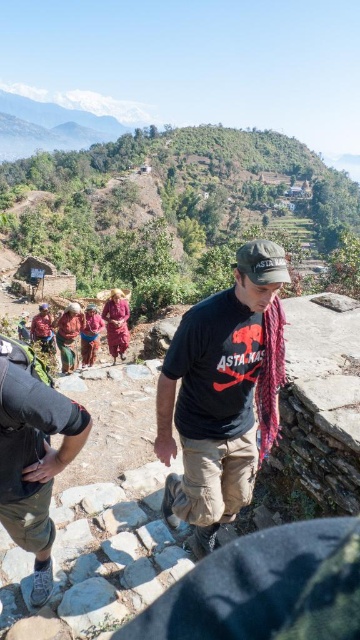
Question: Which object is closer to the camera taking this photo?

Choices:
 (A) purple fabric at center
 (B) reddish brown fabric at lower left
 (C) black cotton t-shirt at center
 (D) matte red scarf at lower left

Answer: (C)

Question: Which point appears farthest from the camera in this image?

Choices:
 (A) (46, 323)
 (B) (73, 352)

Answer: (A)

Question: Which object is positioned closest to the matte red scarf at lower left?

Choices:
 (A) green grassy hillside at upper center
 (B) black cotton t-shirt at center
 (C) matte khaki shorts at lower left
 (D) purple fabric at center

Answer: (D)

Question: Can you confirm if matte khaki shorts at lower left is thinner than purple fabric at center?

Choices:
 (A) yes
 (B) no

Answer: (A)

Question: Is purple fabric at center positioned at the back of orange fabric skirt at center?

Choices:
 (A) no
 (B) yes

Answer: (A)

Question: Does orange fabric skirt at center have a larger size compared to reddish brown fabric at lower left?

Choices:
 (A) yes
 (B) no

Answer: (B)